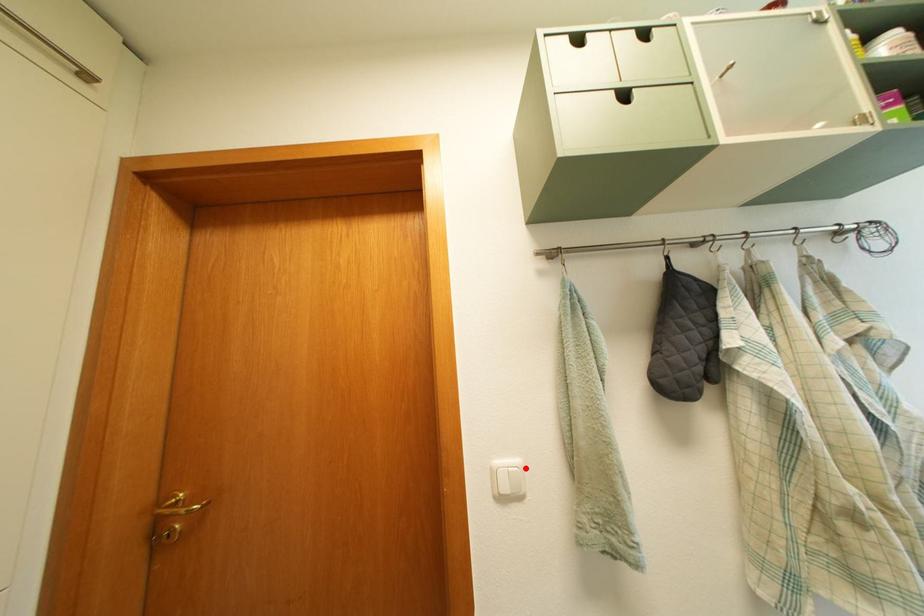
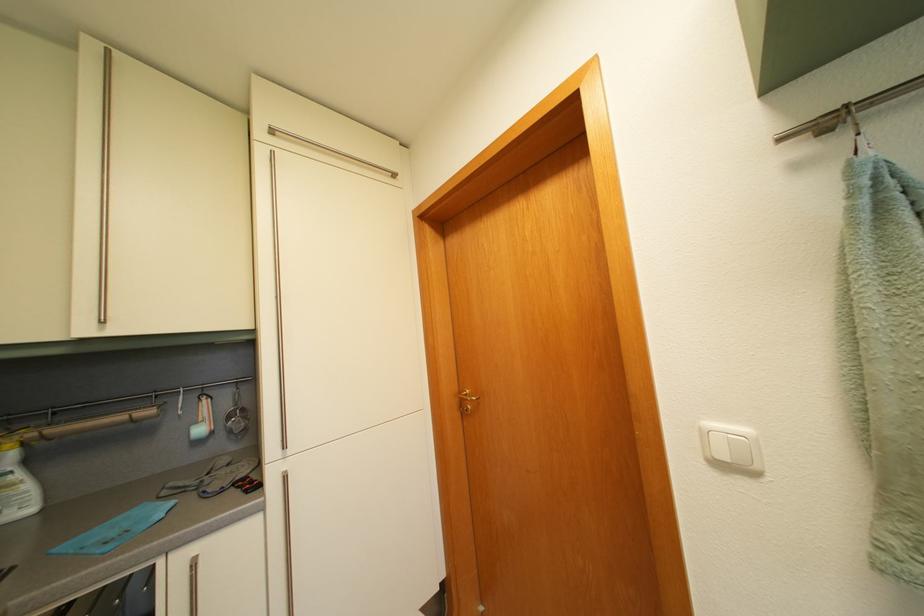
Where in the second image is the point corresponding to the highlighted location from the first image?

(755, 438)